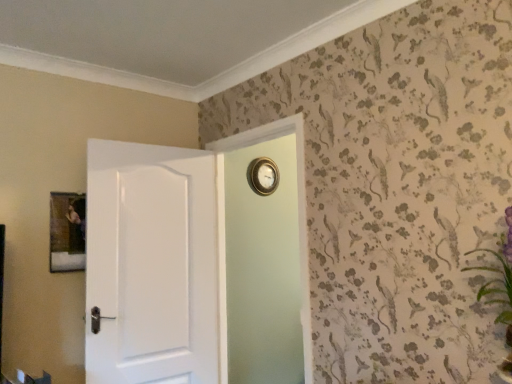
Question: Is gold metallic clock at upper center inside or outside of wooden picture frame at upper left?

Choices:
 (A) outside
 (B) inside

Answer: (A)

Question: Considering the positions of gold metallic clock at upper center and wooden picture frame at upper left in the image, is gold metallic clock at upper center bigger or smaller than wooden picture frame at upper left?

Choices:
 (A) big
 (B) small

Answer: (B)

Question: Considering the real-world distances, which object is closest to the green textured plant at upper right?

Choices:
 (A) gold metallic clock at upper center
 (B) white glossy door at left
 (C) wooden picture frame at upper left
 (D) gold metallic clock at upper center

Answer: (B)

Question: Which object is positioned closest to the wooden picture frame at upper left?

Choices:
 (A) white glossy door at left
 (B) green textured plant at upper right
 (C) gold metallic clock at upper center
 (D) gold metallic clock at upper center

Answer: (A)